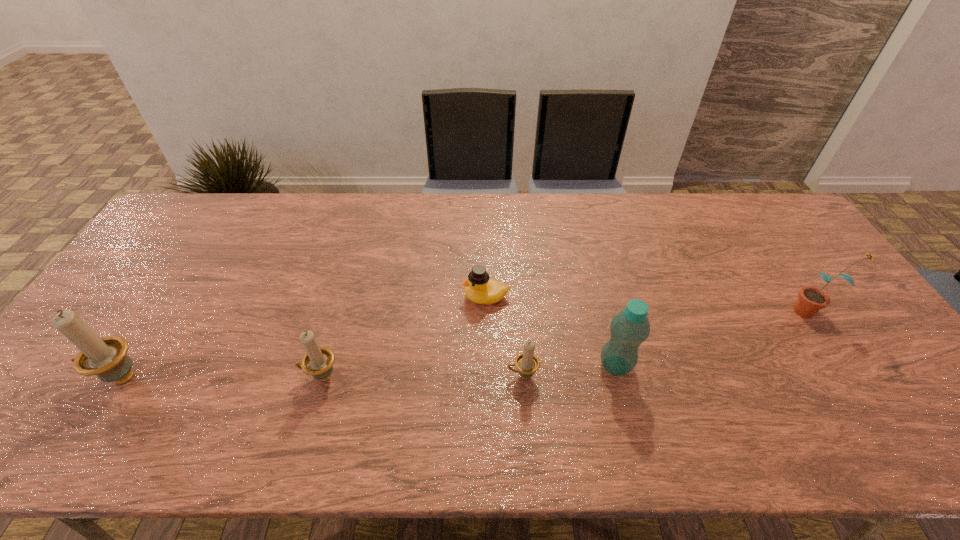
Where is `free spot between the rightmost candle_holder and the water bottle`? Image resolution: width=960 pixels, height=540 pixels. free spot between the rightmost candle_holder and the water bottle is located at coordinates (569, 370).

Locate an element on the screen. The width and height of the screenshot is (960, 540). free space between the second object from right to left and the second shortest candle_holder is located at coordinates (468, 371).

Find the location of a particular element. This screenshot has height=540, width=960. empty space between the sunflower and the second object from right to left is located at coordinates [x=713, y=338].

Select which object appears as the closest to the duck. Please provide its 2D coordinates. Your answer should be formatted as a tuple, i.e. [(x, y)], where the tuple contains the x and y coordinates of a point satisfying the conditions above.

[(527, 363)]

Identify which object is the fourth nearest to the second candle_holder from left to right. Please provide its 2D coordinates. Your answer should be formatted as a tuple, i.e. [(x, y)], where the tuple contains the x and y coordinates of a point satisfying the conditions above.

[(630, 328)]

Select which candle_holder appears as the second closest to the water bottle. Please provide its 2D coordinates. Your answer should be formatted as a tuple, i.e. [(x, y)], where the tuple contains the x and y coordinates of a point satisfying the conditions above.

[(318, 361)]

This screenshot has width=960, height=540. I want to click on candle_holder that is the second closest to the fifth object from left to right, so click(318, 361).